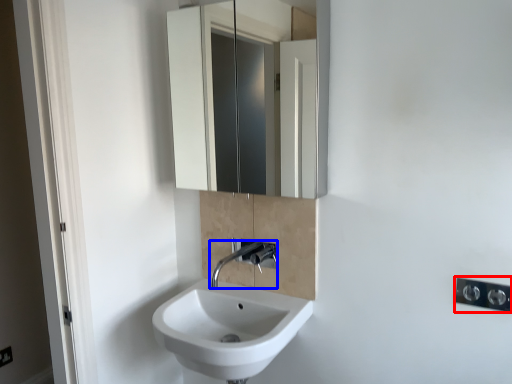
Question: Among these objects, which one is farthest to the camera, light switch (highlighted by a red box) or tap (highlighted by a blue box)?

Choices:
 (A) light switch
 (B) tap

Answer: (B)